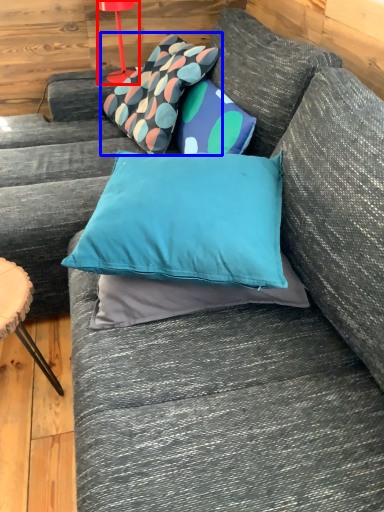
Question: Which of the following is the farthest to the observer, table lamp (highlighted by a red box) or pillow (highlighted by a blue box)?

Choices:
 (A) table lamp
 (B) pillow

Answer: (A)